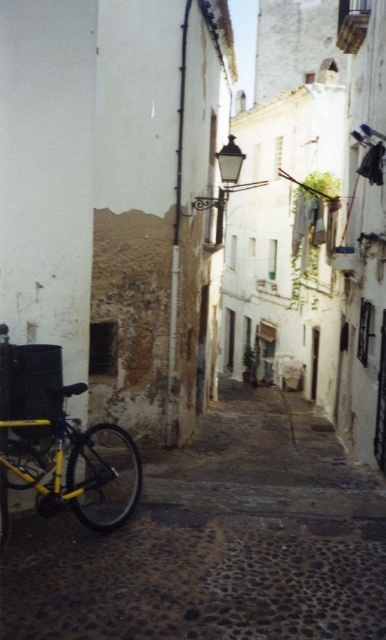
You are standing at the entrance of the narrow alleyway and want to reach a point in the image. Which of the two points, point (360, 625) or point (130, 481), is closer to you?

Point (360, 625) is closer to the viewer than point (130, 481).

Based on the photo, you are standing at the entrance of the alleyway and want to park your car. The yellow metallic bicycle at lower left is in the way. Based on its 2D coordinates, can you estimate how far to the right you should move to avoid it?

The yellow metallic bicycle at lower left is located at coordinates 0.847 on the x and 0.562 on the y. To avoid it, you should move to the right side of the alley, keeping a safe distance from the bicycle.

You are a tourist standing at the entrance of the alleyway. You want to take a photo of the yellow metallic bicycle at lower left without any obstructions. Given that your camera has a minimum focusing distance of 2 meters, will you be able to take a clear photo of the bicycle from your current position?

The yellow metallic bicycle at lower left and viewer are 3.29 meters apart. Since the minimum focusing distance is 2 meters, you can take a clear photo of the yellow metallic bicycle at lower left from your current position because you are farther than the minimum required distance.